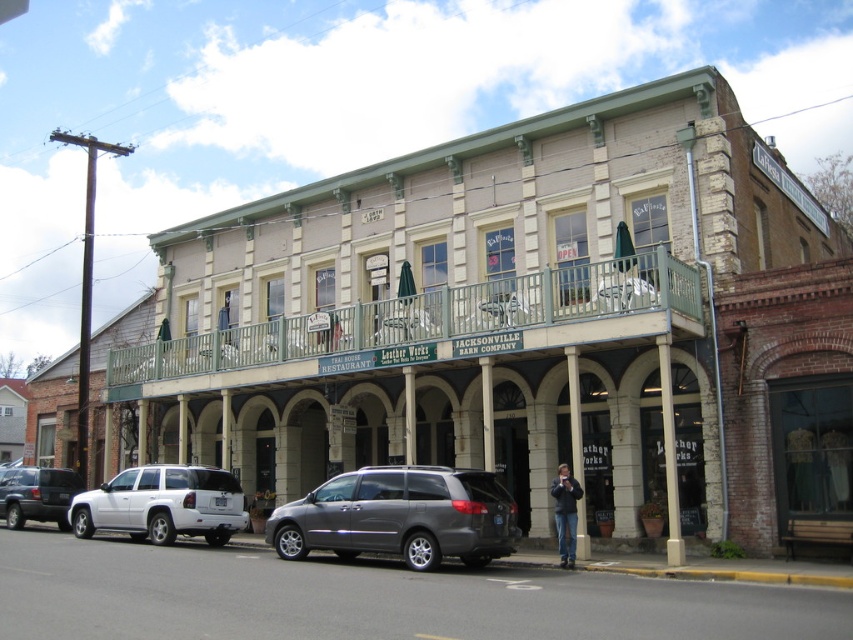
What do you see at coordinates (428, 323) in the screenshot? This screenshot has width=853, height=640. I see `green metal railing at upper center` at bounding box center [428, 323].

Does green metal railing at upper center have a greater width compared to metallic gray minivan at center?

Yes.

Describe the element at coordinates (428, 323) in the screenshot. This screenshot has width=853, height=640. I see `green metal railing at upper center` at that location.

Find the location of `green metal railing at upper center`. green metal railing at upper center is located at coordinates (428, 323).

Based on the photo, can you confirm if white matte suv at lower left is positioned below matte black suv at lower left?

Actually, white matte suv at lower left is above matte black suv at lower left.

Where is `white matte suv at lower left`? white matte suv at lower left is located at coordinates (163, 504).

This screenshot has height=640, width=853. I want to click on white matte suv at lower left, so click(x=163, y=504).

Does green metal railing at upper center appear on the left side of white matte suv at lower left?

Incorrect, green metal railing at upper center is not on the left side of white matte suv at lower left.

Who is more distant from viewer, (675, 282) or (90, 536)?

The point (90, 536) is behind.

Locate an element on the screen. The image size is (853, 640). green metal railing at upper center is located at coordinates (428, 323).